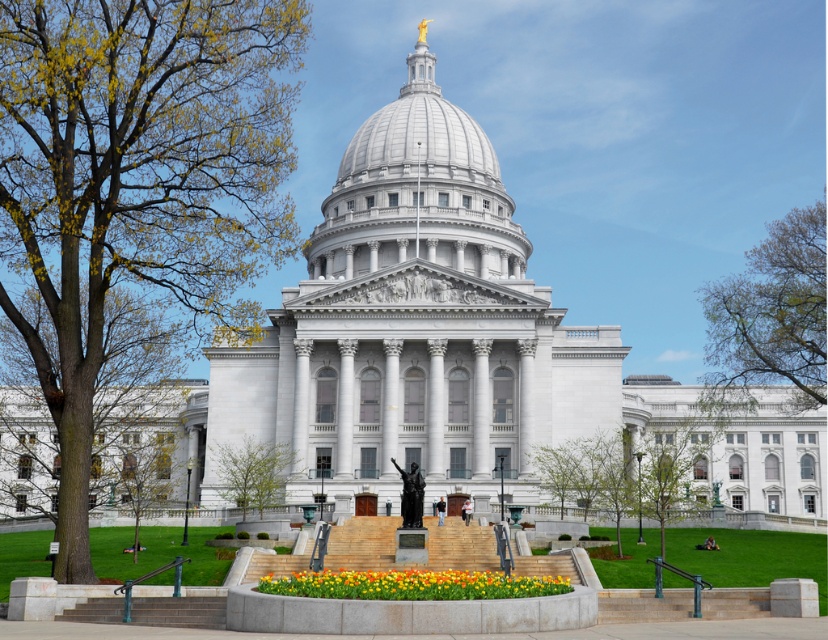
Which is behind, point (503, 212) or point (805, 291)?

The point (503, 212) is behind.

How distant is white marble dome at center from brown leafy tree at upper right?

white marble dome at center and brown leafy tree at upper right are 34.31 meters apart from each other.

The width and height of the screenshot is (828, 640). What are the coordinates of `white marble dome at center` in the screenshot? It's located at (417, 189).

At what (x,y) coordinates should I click in order to perform the action: click on white marble dome at center. Please return your answer as a coordinate pair (x, y). Looking at the image, I should click on (417, 189).

Between brown leafy tree at upper right and green leafy tree at lower left, which one has less height?

Standing shorter between the two is green leafy tree at lower left.

Which is more to the left, brown leafy tree at upper right or green leafy tree at lower left?

green leafy tree at lower left

Does point (725, 292) come in front of point (162, 480)?

No.

This screenshot has height=640, width=828. In order to click on brown leafy tree at upper right in this screenshot , I will do `click(773, 310)`.

Which is more to the right, white marble dome at center or vibrant tulips at center?

From the viewer's perspective, vibrant tulips at center appears more on the right side.

Describe the element at coordinates (417, 189) in the screenshot. The height and width of the screenshot is (640, 828). I see `white marble dome at center` at that location.

Find the location of a particular element. white marble dome at center is located at coordinates click(417, 189).